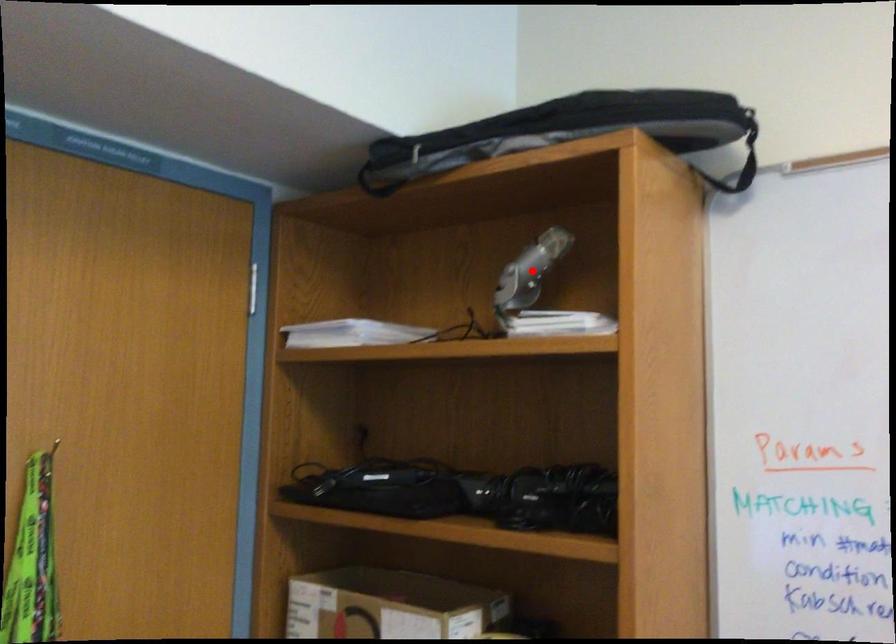
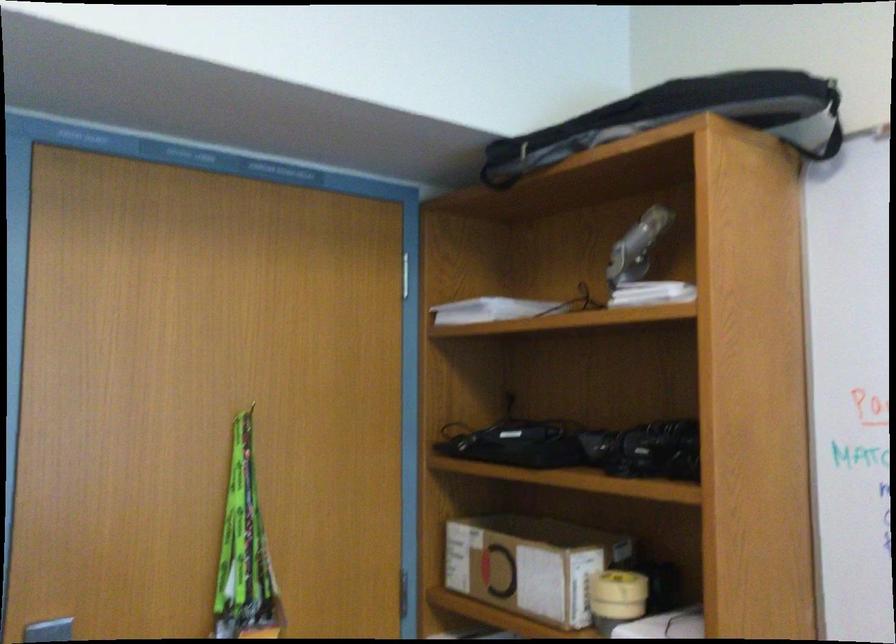
In the second image, find the point that corresponds to the highlighted location in the first image.

(636, 247)